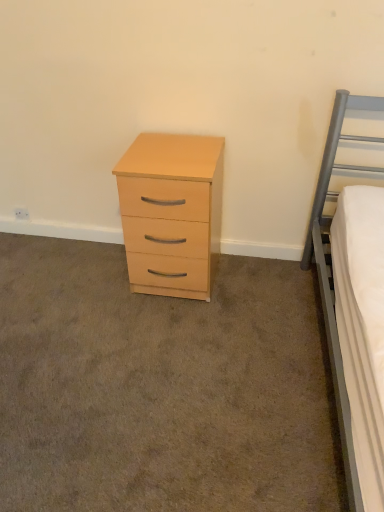
Where is `vacant space to the left of light wood/veneer chest of drawers at center`? The width and height of the screenshot is (384, 512). vacant space to the left of light wood/veneer chest of drawers at center is located at coordinates (90, 283).